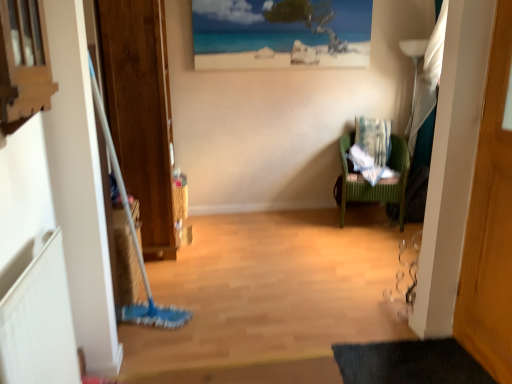
I want to click on free space below green plastic chair at right (from a real-world perspective), so click(x=370, y=215).